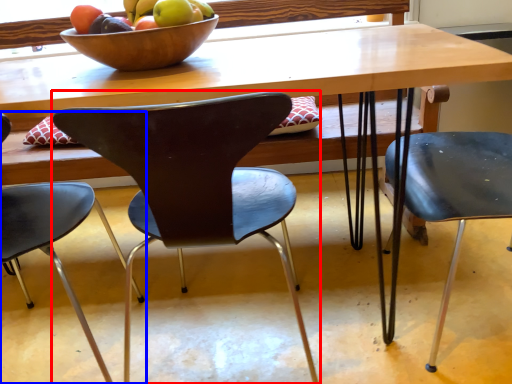
Question: Which object appears farthest to the camera in this image, chair (highlighted by a red box) or chair (highlighted by a blue box)?

Choices:
 (A) chair
 (B) chair

Answer: (A)